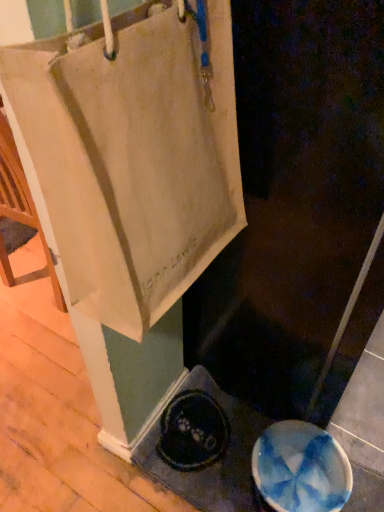
The image size is (384, 512). What do you see at coordinates (134, 152) in the screenshot?
I see `beige canvas tote at upper left` at bounding box center [134, 152].

What do you see at coordinates (301, 469) in the screenshot? I see `blue glossy manhole cover at lower right` at bounding box center [301, 469].

Find the location of a particular element. This screenshot has width=384, height=512. white canvas bag at upper left is located at coordinates (294, 198).

You are a GUI agent. You are given a task and a screenshot of the screen. Output one action in this format:
    pyautogui.click(x=<x>, y=<y>)
    Task: Click on the beige canvas tote at upper left
    The image size is (384, 512).
    Given the screenshot: What is the action you would take?
    pyautogui.click(x=134, y=152)

Consider the image. Who is shorter, blue glossy manhole cover at lower right or white canvas bag at upper left?

blue glossy manhole cover at lower right is shorter.

Looking at this image, is blue glossy manhole cover at lower right positioned with its back to white canvas bag at upper left?

Correct, blue glossy manhole cover at lower right is looking away from white canvas bag at upper left.

Considering the sizes of blue glossy manhole cover at lower right and white canvas bag at upper left in the image, is blue glossy manhole cover at lower right wider or thinner than white canvas bag at upper left?

blue glossy manhole cover at lower right is thinner than white canvas bag at upper left.

Does white canvas bag at upper left have a smaller size compared to blue glossy manhole cover at lower right?

Actually, white canvas bag at upper left might be larger than blue glossy manhole cover at lower right.

Locate an element on the screen. The width and height of the screenshot is (384, 512). manhole cover below the white canvas bag at upper left (from the image's perspective) is located at coordinates click(301, 469).

Is the position of white canvas bag at upper left less distant than that of blue glossy manhole cover at lower right?

Yes, white canvas bag at upper left is closer to the camera.

From a real-world perspective, is white canvas bag at upper left located beneath blue glossy manhole cover at lower right?

No, from a real-world perspective, white canvas bag at upper left is not below blue glossy manhole cover at lower right.

Where is `screen door that appears below the beige canvas tote at upper left (from a real-world perspective)`? This screenshot has height=512, width=384. screen door that appears below the beige canvas tote at upper left (from a real-world perspective) is located at coordinates (294, 198).

How many degrees apart are the facing directions of white canvas bag at upper left and beige canvas tote at upper left?

The angular difference between white canvas bag at upper left and beige canvas tote at upper left is 0.0859 degrees.

Considering the relative sizes of white canvas bag at upper left and beige canvas tote at upper left in the image provided, is white canvas bag at upper left taller than beige canvas tote at upper left?

Correct, white canvas bag at upper left is much taller as beige canvas tote at upper left.

Is white canvas bag at upper left oriented away from beige canvas tote at upper left?

No, white canvas bag at upper left is not facing the opposite direction of beige canvas tote at upper left.

Could you tell me if beige canvas tote at upper left is facing white canvas bag at upper left?

No.

From the image's perspective, is beige canvas tote at upper left positioned above or below white canvas bag at upper left?

From the image's perspective, beige canvas tote at upper left appears above white canvas bag at upper left.

Can you confirm if beige canvas tote at upper left is taller than white canvas bag at upper left?

No, beige canvas tote at upper left is not taller than white canvas bag at upper left.

Does beige canvas tote at upper left touch white canvas bag at upper left?

No, beige canvas tote at upper left is not touching white canvas bag at upper left.

Looking at this image, which of these two, beige canvas tote at upper left or blue glossy manhole cover at lower right, stands taller?

beige canvas tote at upper left.

Which is correct: beige canvas tote at upper left is inside blue glossy manhole cover at lower right, or outside of it?

beige canvas tote at upper left is spatially situated outside blue glossy manhole cover at lower right.

From a real-world perspective, is beige canvas tote at upper left physically below blue glossy manhole cover at lower right?

Incorrect, from a real-world perspective, beige canvas tote at upper left is higher than blue glossy manhole cover at lower right.

From the picture: Is beige canvas tote at upper left wider than blue glossy manhole cover at lower right?

In fact, beige canvas tote at upper left might be narrower than blue glossy manhole cover at lower right.

Who is smaller, blue glossy manhole cover at lower right or beige canvas tote at upper left?

blue glossy manhole cover at lower right.

Is beige canvas tote at upper left at the back of blue glossy manhole cover at lower right?

blue glossy manhole cover at lower right is not turned away from beige canvas tote at upper left.

Does point (318, 456) come farther from viewer compared to point (153, 249)?

Yes, it is.

At what (x,y) coordinates should I click in order to perform the action: click on screen door above the blue glossy manhole cover at lower right (from a real-world perspective). Please return your answer as a coordinate pair (x, y). Looking at the image, I should click on (294, 198).

You are a GUI agent. You are given a task and a screenshot of the screen. Output one action in this format:
    pyautogui.click(x=<x>, y=<y>)
    Task: Click on the manhole cover below the white canvas bag at upper left (from a real-world perspective)
    This screenshot has width=384, height=512.
    Given the screenshot: What is the action you would take?
    pyautogui.click(x=301, y=469)

When comparing their distances from white canvas bag at upper left, does blue glossy manhole cover at lower right or beige canvas tote at upper left seem closer?

beige canvas tote at upper left is positioned closer to the anchor white canvas bag at upper left.

Considering their positions, is beige canvas tote at upper left positioned further to white canvas bag at upper left than blue glossy manhole cover at lower right?

blue glossy manhole cover at lower right is positioned further to the anchor white canvas bag at upper left.

From the image, which object appears to be nearer to beige canvas tote at upper left, white canvas bag at upper left or blue glossy manhole cover at lower right?

white canvas bag at upper left is closer to beige canvas tote at upper left.

Looking at the image, which one is located closer to beige canvas tote at upper left, blue glossy manhole cover at lower right or white canvas bag at upper left?

Among the two, white canvas bag at upper left is located nearer to beige canvas tote at upper left.

Estimate the real-world distances between objects in this image. Which object is closer to blue glossy manhole cover at lower right, beige canvas tote at upper left or white canvas bag at upper left?

white canvas bag at upper left lies closer to blue glossy manhole cover at lower right than the other object.

Which object lies nearer to the anchor point blue glossy manhole cover at lower right, white canvas bag at upper left or beige canvas tote at upper left?

white canvas bag at upper left is closer to blue glossy manhole cover at lower right.

You are a GUI agent. You are given a task and a screenshot of the screen. Output one action in this format:
    pyautogui.click(x=<x>, y=<y>)
    Task: Click on the screen door between beige canvas tote at upper left and blue glossy manhole cover at lower right in the vertical direction
    The image size is (384, 512).
    Given the screenshot: What is the action you would take?
    pyautogui.click(x=294, y=198)